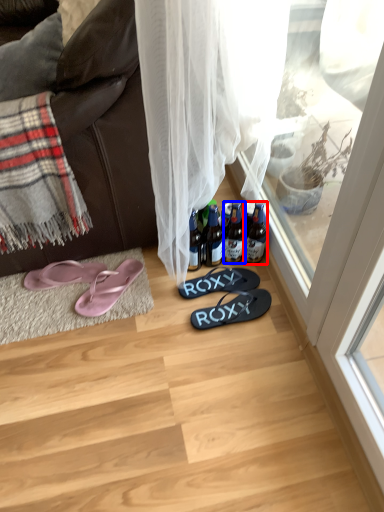
Question: Which object is further to the camera taking this photo, bottle (highlighted by a red box) or bottle (highlighted by a blue box)?

Choices:
 (A) bottle
 (B) bottle

Answer: (A)